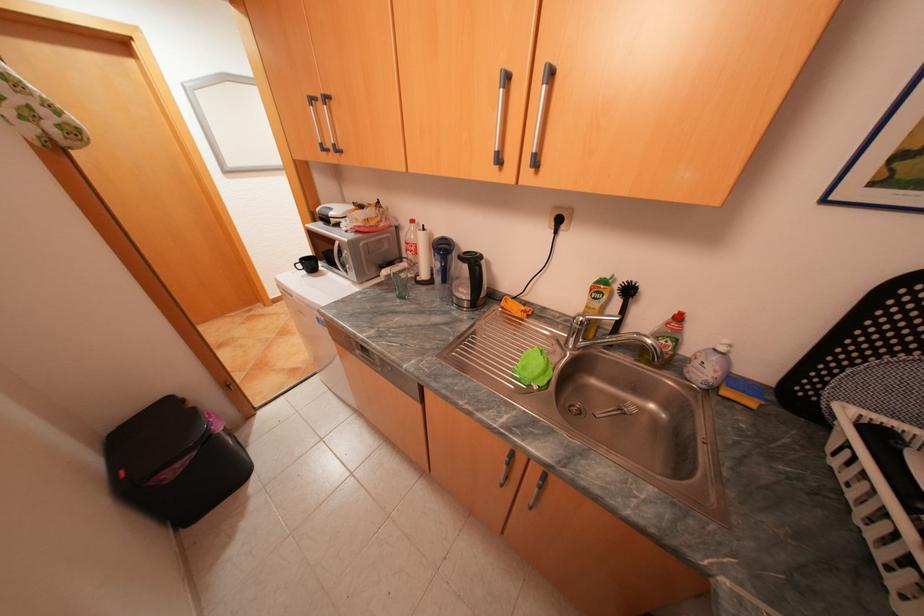
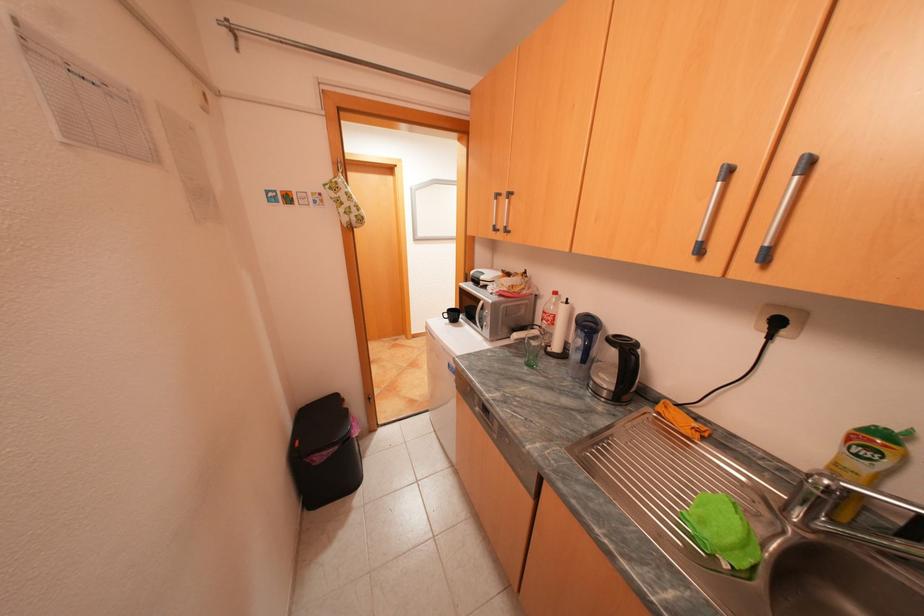
In the second image, find the point that corresponds to (331,144) in the first image.

(504, 225)